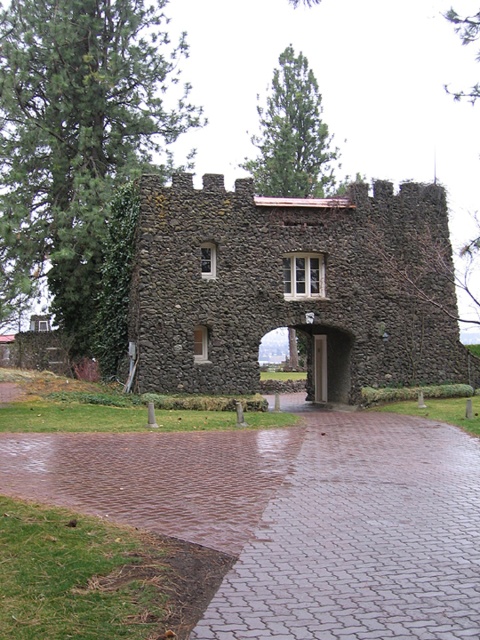
You are standing in front of the stone structure and want to find the entrance. Which direction should you walk towards the brick paved path at center?

The brick paved path at center is located at point (361, 538), so you should walk towards the center of the image to reach the entrance.

You are standing in front of the stone structure and want to enter through the entrance. Where exactly is the rustic stone gate at center located in terms of coordinates?

The rustic stone gate at center is located at coordinates point (294,288).

You are a traveler approaching the rustic stone gate at center and notice green ivy at left growing nearby. Which object is positioned higher up in the image?

The green ivy at left is positioned higher up in the image than the rustic stone gate at center.